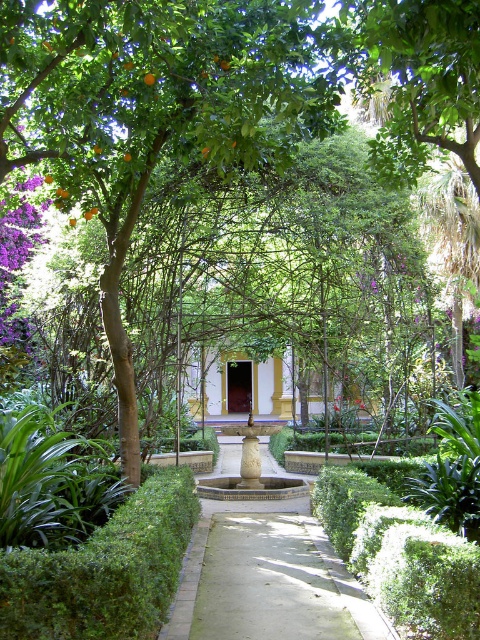
You are a gardener who needs to trim the green leafy hedge at lower left. You are currently standing on the smooth concrete path at center. Which direction should you move to reach the hedge?

The green leafy hedge at lower left is behind the smooth concrete path at center, so you should move backward from the path to reach the hedge.

Based on the photo, you are a gardener planning to walk along the smooth concrete path at center while carrying a large potted plant. Considering the width of the green leafy hedge at lower left, do you think the path is wide enough to accommodate your movement without brushing against the hedge?

The smooth concrete path at center is wider than the green leafy hedge at lower left, so yes, the path is wide enough to accommodate your movement without brushing against the hedge.

You are a gardener who needs to place a 4 feet long decorative statue along the smooth concrete path at center. Considering the distance to the green leafy hedge at lower left, will the statue fit without overlapping the hedge?

The smooth concrete path at center is 3.59 feet away from the green leafy hedge at lower left. Since the statue is 4 feet long, placing it along the path may cause it to overlap with the hedge as the distance between them is less than the statue length.